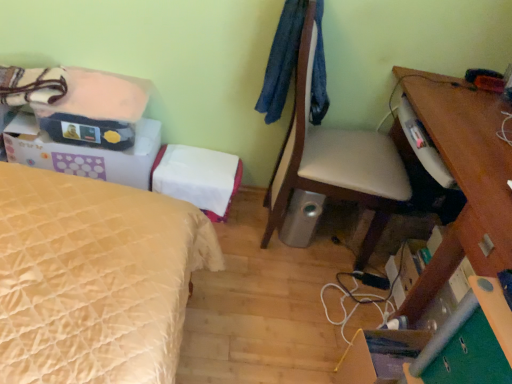
Identify the location of free region on the left part of silver metallic speaker at lower center. Image resolution: width=512 pixels, height=384 pixels. (248, 224).